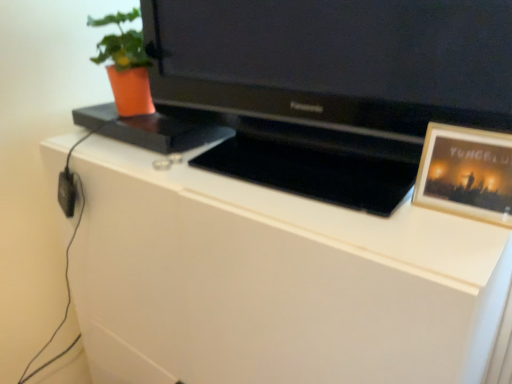
Question: Do you think black glossy television at center is within white matte cabinet at center, or outside of it?

Choices:
 (A) outside
 (B) inside

Answer: (A)

Question: From a real-world perspective, relative to white matte cabinet at center, is black glossy television at center vertically above or below?

Choices:
 (A) below
 (B) above

Answer: (B)

Question: Estimate the real-world distances between objects in this image. Which object is farther from the black glossy television at center?

Choices:
 (A) orange matte pot at upper left
 (B) white matte cabinet at center
 (C) gold-framed photo at upper right

Answer: (A)

Question: Considering the real-world distances, which object is closest to the gold-framed photo at upper right?

Choices:
 (A) black glossy television at center
 (B) white matte cabinet at center
 (C) orange matte pot at upper left

Answer: (A)